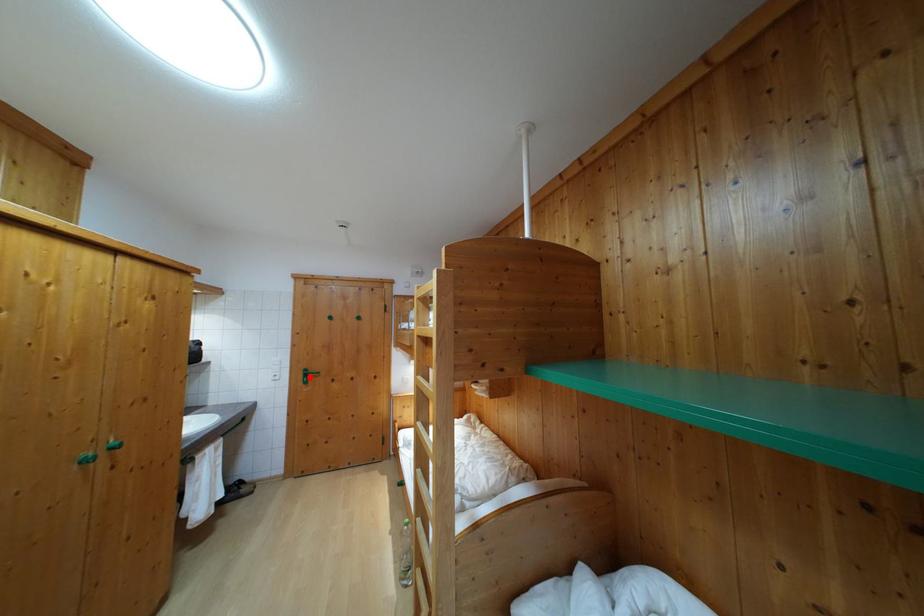
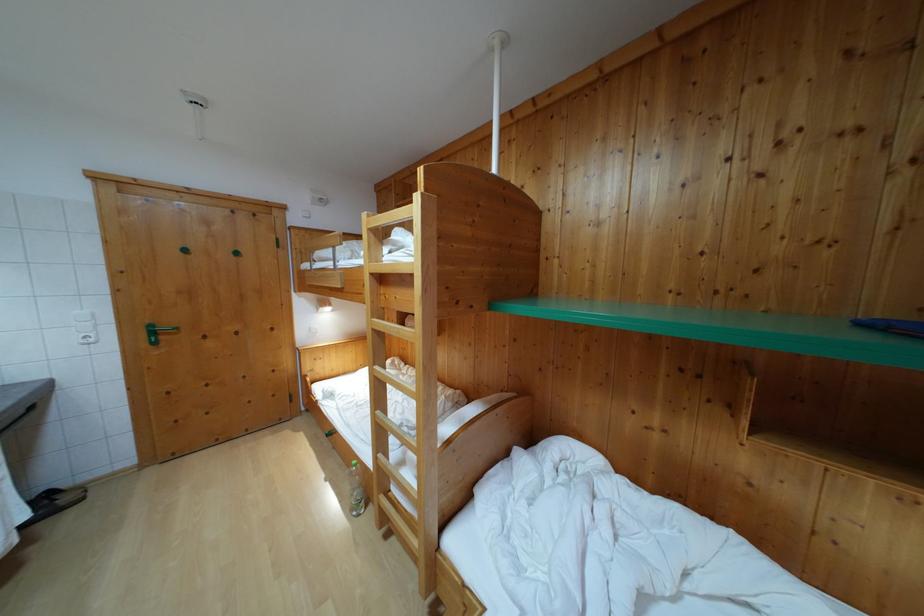
The point at the highlighted location is marked in the first image. Where is the corresponding point in the second image?

(155, 333)